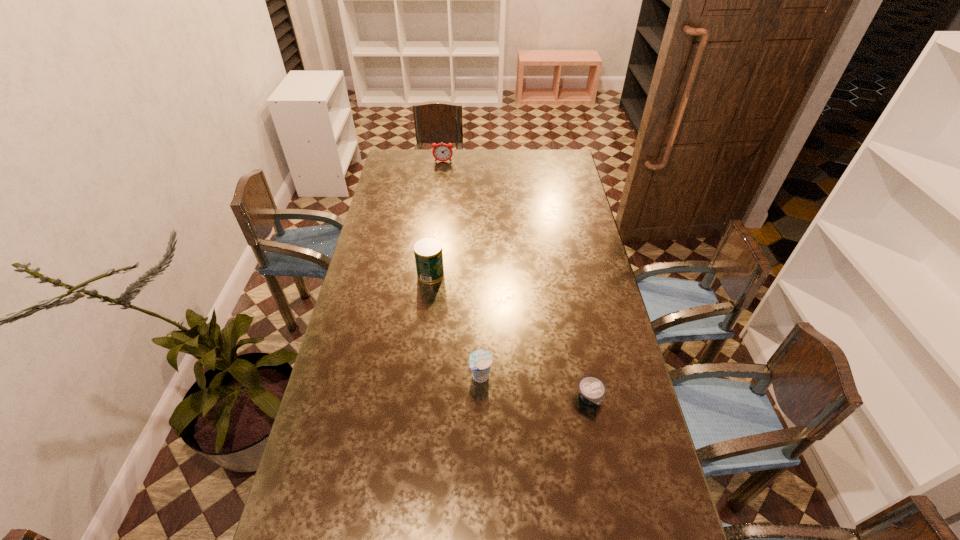
Identify the location of blank region between the second shortest object and the farthest object. The image size is (960, 540). (462, 269).

You are a GUI agent. You are given a task and a screenshot of the screen. Output one action in this format:
    pyautogui.click(x=<x>, y=<y>)
    Task: Click on the unoccupied area between the can and the right yogurt
    
    Given the screenshot: What is the action you would take?
    pyautogui.click(x=511, y=336)

Identify the location of free space that is in between the left yogurt and the third nearest object. The image size is (960, 540). (456, 326).

This screenshot has width=960, height=540. I want to click on vacant area that lies between the shortest object and the third object from left to right, so click(x=536, y=387).

Find the location of a particular element. This screenshot has width=960, height=540. vacant region between the rightmost object and the farthest object is located at coordinates (516, 280).

The height and width of the screenshot is (540, 960). In order to click on vacant area that lies between the alarm clock and the third nearest object in this screenshot , I will do `click(437, 218)`.

Identify the location of unoccupied position between the alarm clock and the third object from left to right. Image resolution: width=960 pixels, height=540 pixels. (x=462, y=269).

Where is `free space between the farthest object and the second farthest object`? The width and height of the screenshot is (960, 540). free space between the farthest object and the second farthest object is located at coordinates point(437,218).

Locate which object is the third closest to the taller yogurt. Please provide its 2D coordinates. Your answer should be formatted as a tuple, i.e. [(x, y)], where the tuple contains the x and y coordinates of a point satisfying the conditions above.

[(442, 152)]

The image size is (960, 540). I want to click on the third closest object to the can, so click(442, 152).